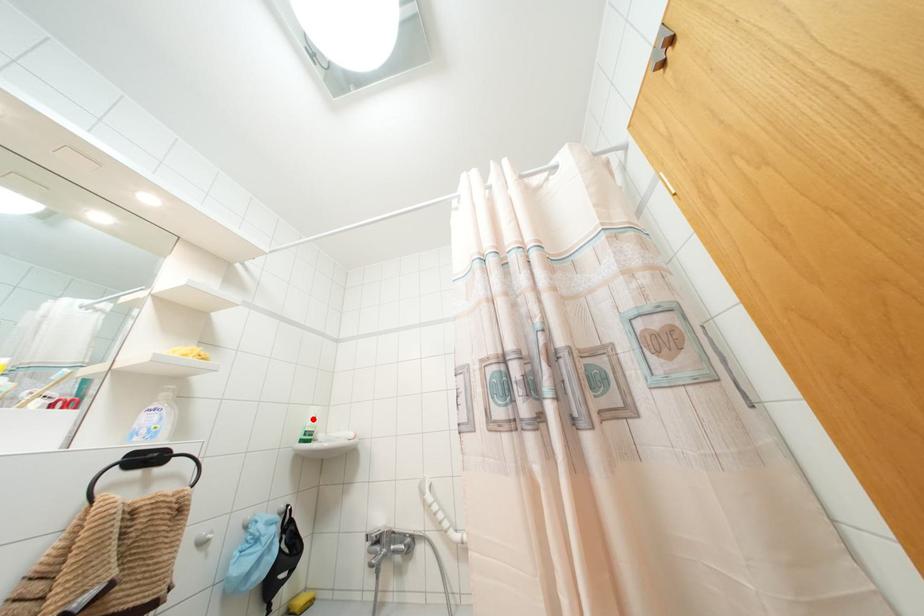
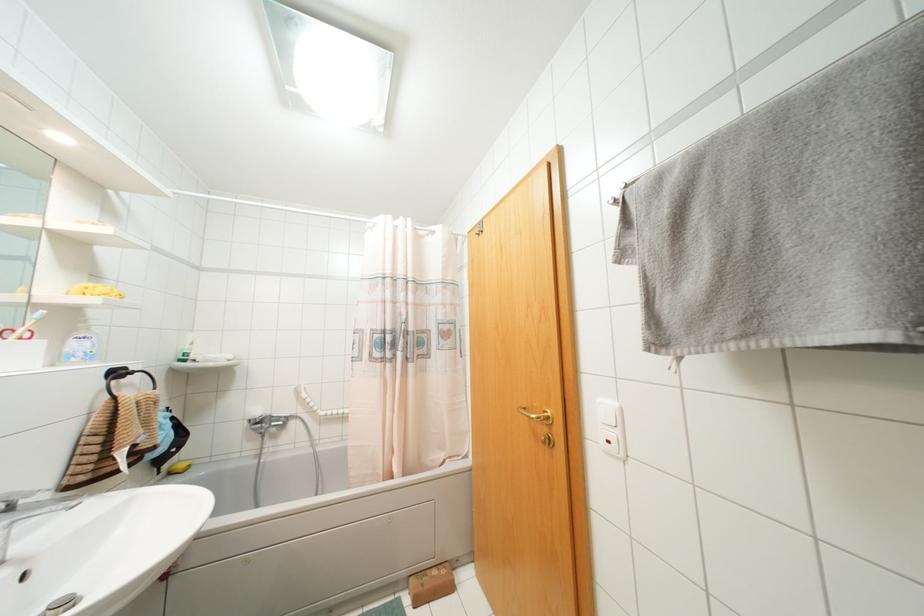
Locate, in the second image, the point that corresponds to the highlighted location in the first image.

(190, 342)